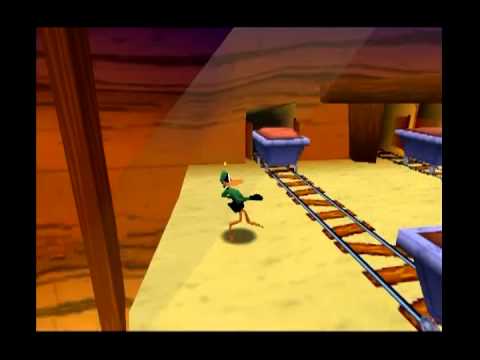
You are a GUI agent. You are given a task and a screenshot of the screen. Output one action in this format:
    pyautogui.click(x=<x>, y=<y>)
    Task: Click on the brown walls
    
    Given the screenshot: What is the action you would take?
    pyautogui.click(x=131, y=82), pyautogui.click(x=139, y=196), pyautogui.click(x=399, y=56)